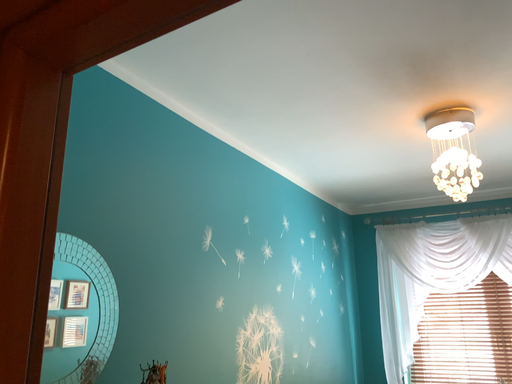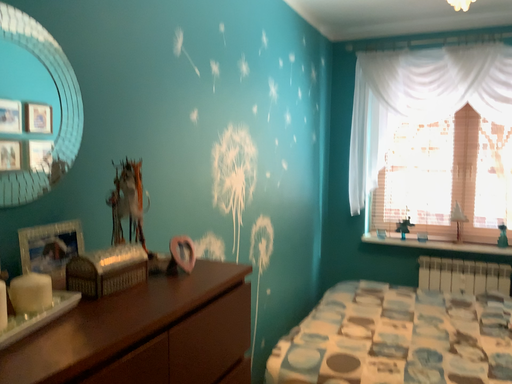
Question: Which way did the camera rotate in the video?

Choices:
 (A) rotated downward
 (B) rotated upward

Answer: (A)